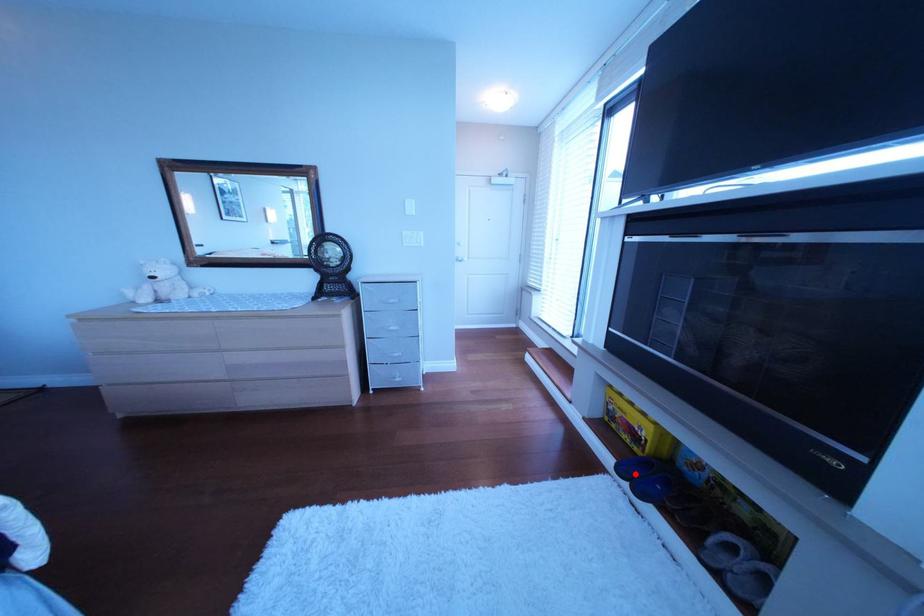
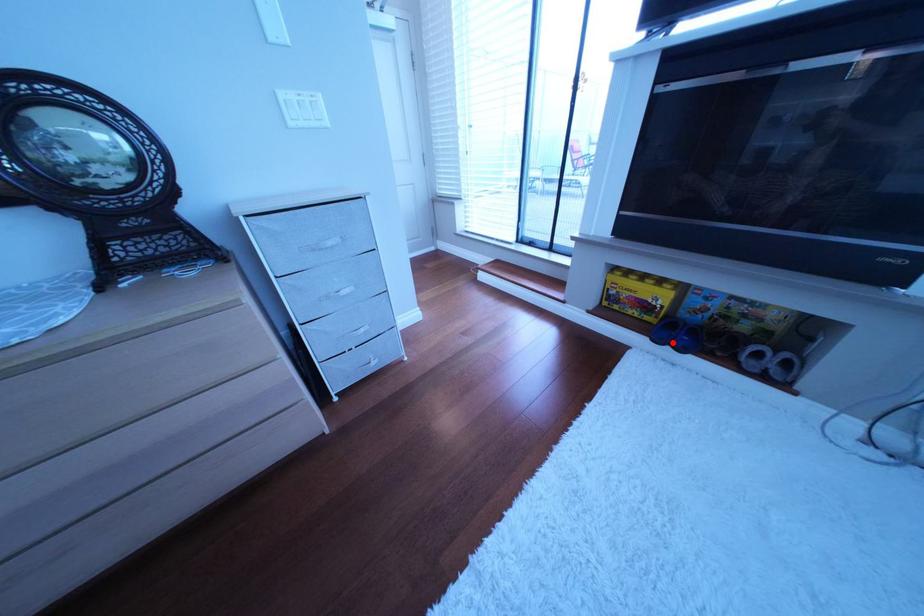
I am providing you with two images of the same scene from different viewpoints. A red point is marked on the first image and another point is marked on the second image. Do the highlighted points in image1 and image2 indicate the same real-world spot?

Yes